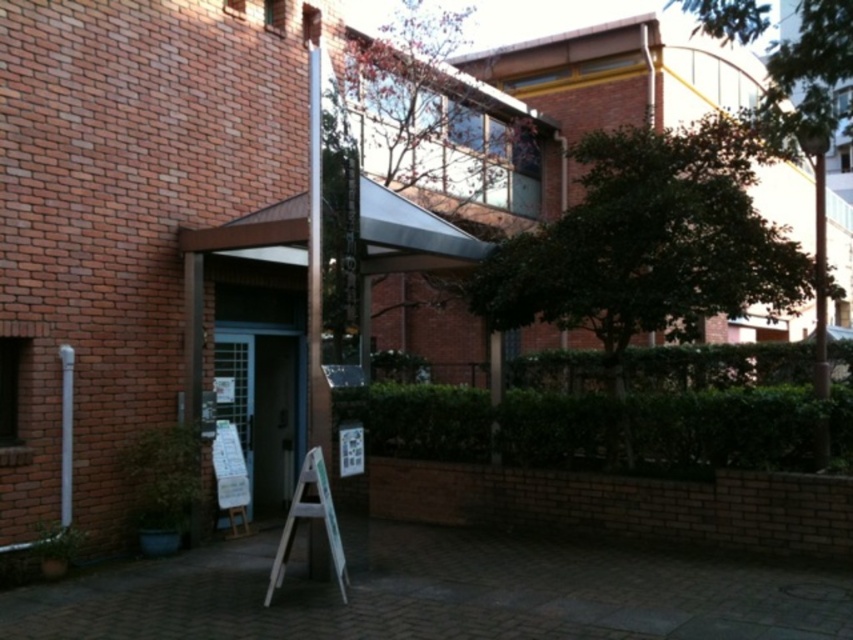
You are a maintenance worker needing to retrieve a tool from the white wood ladder at center. However, there is a silver metallic pole at center in the way. Can you access the ladder without moving the pole?

The silver metallic pole at center is positioned over the white wood ladder at center, so you cannot access the ladder without moving the pole.

You are a maintenance worker who needs to replace a light bulb on the ceiling of the entrance. You have the white wood ladder at center and the white paper sign at center available. Which object should you use to reach the ceiling?

The white wood ladder at center has a larger size compared to the white paper sign at center, so you should use the white wood ladder at center to reach the ceiling.

You are a visitor approaching the entrance of the brick building. You see a silver metallic pole at center and a white paper sign at center. Which object is positioned higher from the ground?

The silver metallic pole at center is positioned higher from the ground than the white paper sign at center.